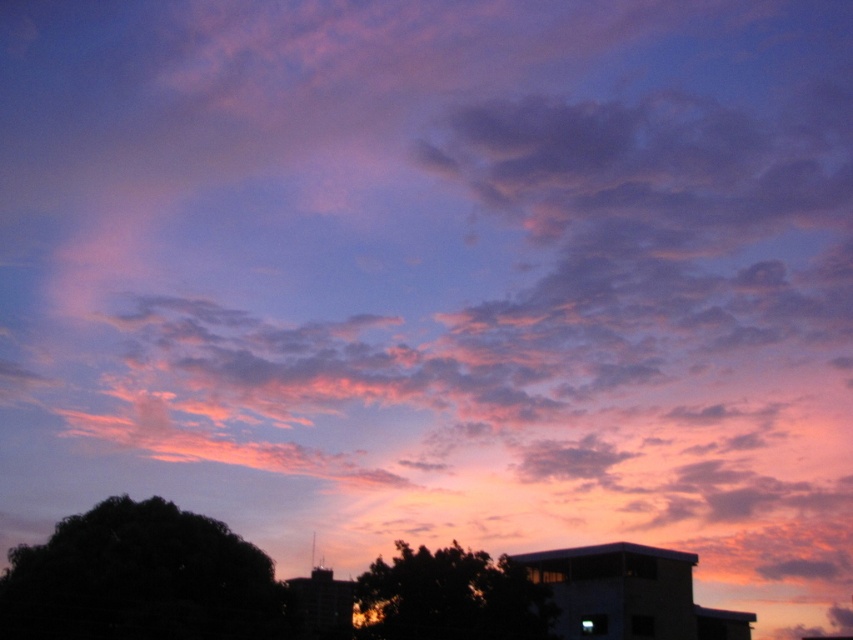
You are standing at the point where the image was taken and want to know how far you are from the point marked at coordinates (202, 525) in the image. Can you determine the distance?

The point marked at coordinates (202, 525) is 182.58 feet away from you.

You are standing at the center of the image and want to walk towards the dark green leafy tree at lower left. Which direction should you face to head directly towards it?

To head directly towards the dark green leafy tree at lower left from the center, you should face the lower left direction since the tree is located at point (141,579), which is in the lower left quadrant of the image.